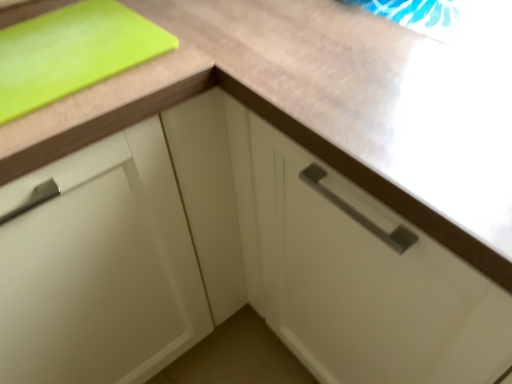
The width and height of the screenshot is (512, 384). I want to click on free point above green matte cutting board at upper left (from a real-world perspective), so 59,42.